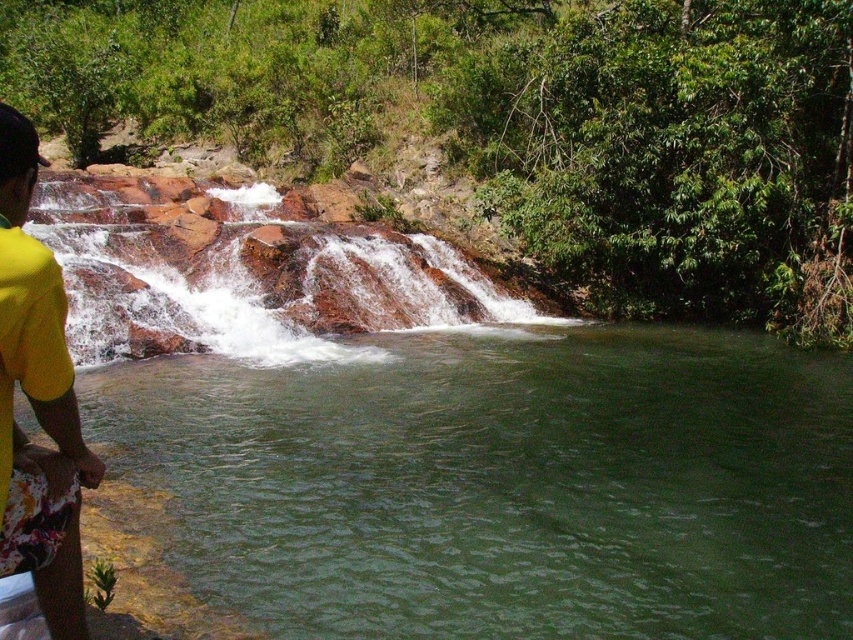
You are a hiker who wants to cross the river. You see the green smooth river at lower left and the rusty rock waterfall at center. Which direction should you head to cross the river safely?

The green smooth river at lower left is in front of the rusty rock waterfall at center, so you should head towards the green smooth river at lower left to cross the river safely as it is calmer and more accessible than the waterfall area.

You are standing at the edge of the pool and want to take a photo of the rusty rock waterfall at center without the yellow fabric shorts at lower left appearing in the frame. Which direction should you move to achieve this?

Move to the right side since the rusty rock waterfall at center is to the left of the yellow fabric shorts at lower left, so moving right would position the waterfall away from the shorts and out of the frame.

You are a hiker who wants to take a photo of the rusty rock waterfall at center and the yellow fabric shorts at lower left. Which object should be placed closer to the camera to ensure both are in focus?

The rusty rock waterfall at center is taller than the yellow fabric shorts at lower left, so to ensure both are in focus, place the camera closer to the shorter object, which is the yellow fabric shorts at lower left.